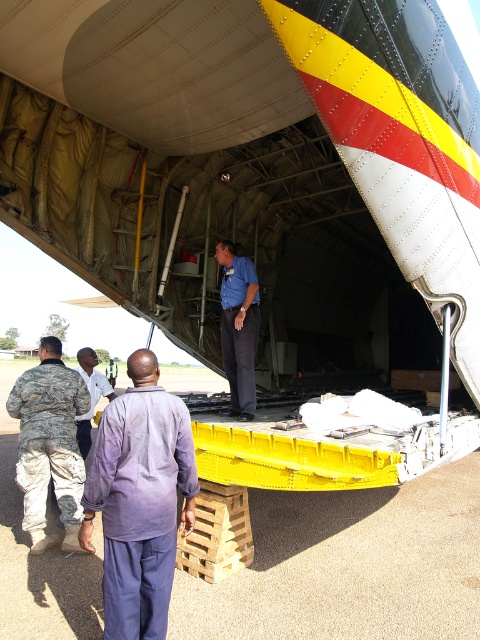
Question: Does camouflage fabric uniform at left have a larger size compared to blue shirt at center?

Choices:
 (A) no
 (B) yes

Answer: (B)

Question: Can you confirm if blue shirt at center is positioned below light purple shirt at center?

Choices:
 (A) no
 (B) yes

Answer: (A)

Question: Can you confirm if purple cotton shirt at center is positioned above light purple shirt at center?

Choices:
 (A) yes
 (B) no

Answer: (B)

Question: Estimate the real-world distances between objects in this image. Which object is closer to the camouflage fabric uniform at left?

Choices:
 (A) light purple shirt at center
 (B) purple cotton shirt at center
 (C) blue shirt at center

Answer: (A)

Question: Which object is closer to the camera taking this photo?

Choices:
 (A) camouflage fabric uniform at left
 (B) purple cotton shirt at center
 (C) light purple shirt at center

Answer: (B)

Question: Which object appears farthest from the camera in this image?

Choices:
 (A) purple cotton shirt at center
 (B) light purple shirt at center

Answer: (B)